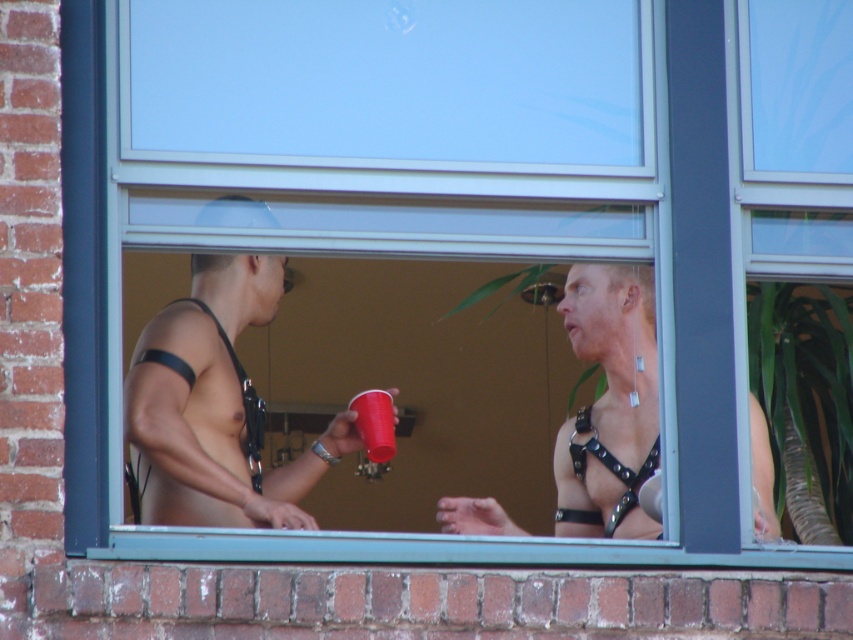
You are an observer standing in front of the window where the two people are talking. Which harness is closer to your left side, the matte black harness at center or the black leather harness at center?

The matte black harness at center is closer to your left side because it is positioned to the left of the black leather harness at center.

You are standing in front of the window where the two shirtless individuals are talking. There are two points marked on the window glass at coordinates point (759,442) and point (374,432). Which of these two points is closer to your face as you look through the window?

Point (759,442) is closer to the camera than point (374,432), so the point at (759,442) would be closer to your face as you look through the window.